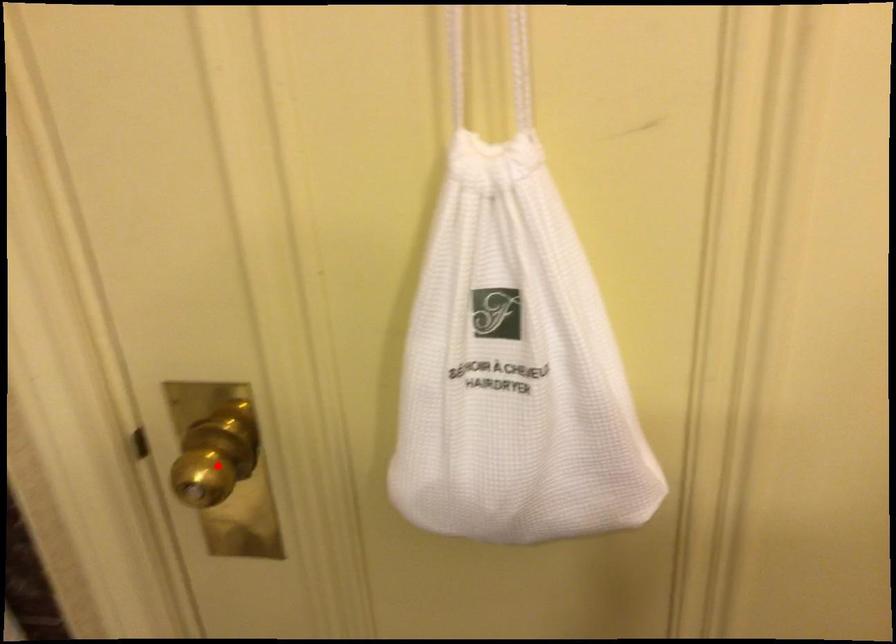
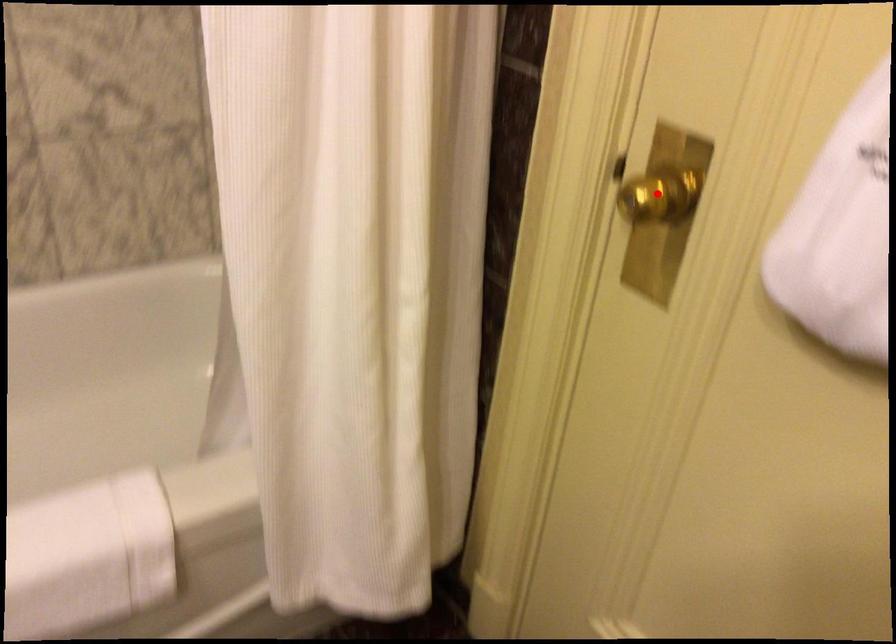
I am providing you with two images of the same scene from different viewpoints. A red point is marked on the first image and another point is marked on the second image. Do the highlighted points in image1 and image2 indicate the same real-world spot?

Yes